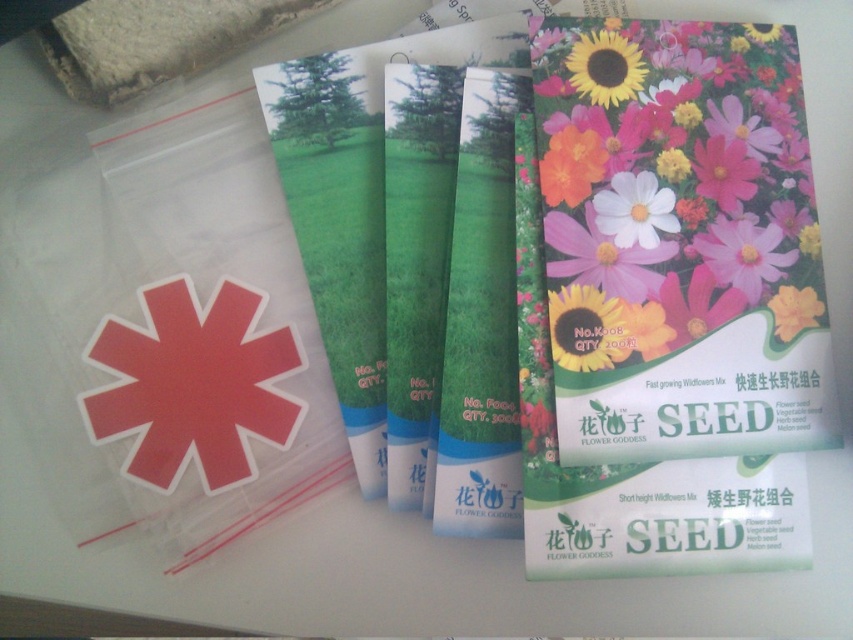
Does floral-patterned paper seed packet at center have a greater height compared to matte paper sunflower at right?

Yes, floral-patterned paper seed packet at center is taller than matte paper sunflower at right.

Does point (738, 435) lie in front of point (589, 300)?

Yes, point (738, 435) is closer to viewer.

Image resolution: width=853 pixels, height=640 pixels. Identify the location of floral-patterned paper seed packet at center. (672, 308).

Who is more distant from viewer, (x=740, y=512) or (x=585, y=83)?

Point (x=585, y=83)

Who is more forward, (572, 35) or (610, 76)?

Point (610, 76) is in front.

The width and height of the screenshot is (853, 640). I want to click on floral-patterned paper seed packet at center, so click(x=672, y=308).

This screenshot has width=853, height=640. I want to click on floral-patterned paper seed packet at center, so click(x=672, y=308).

Can you confirm if pink matte flower at upper right is smaller than yellow matte sunflower at upper right?

Incorrect, pink matte flower at upper right is not smaller in size than yellow matte sunflower at upper right.

Can you confirm if pink matte flower at upper right is shorter than yellow matte sunflower at upper right?

No.

The width and height of the screenshot is (853, 640). Describe the element at coordinates (602, 257) in the screenshot. I see `pink matte flower at upper right` at that location.

Identify the location of pink matte flower at upper right. (602, 257).